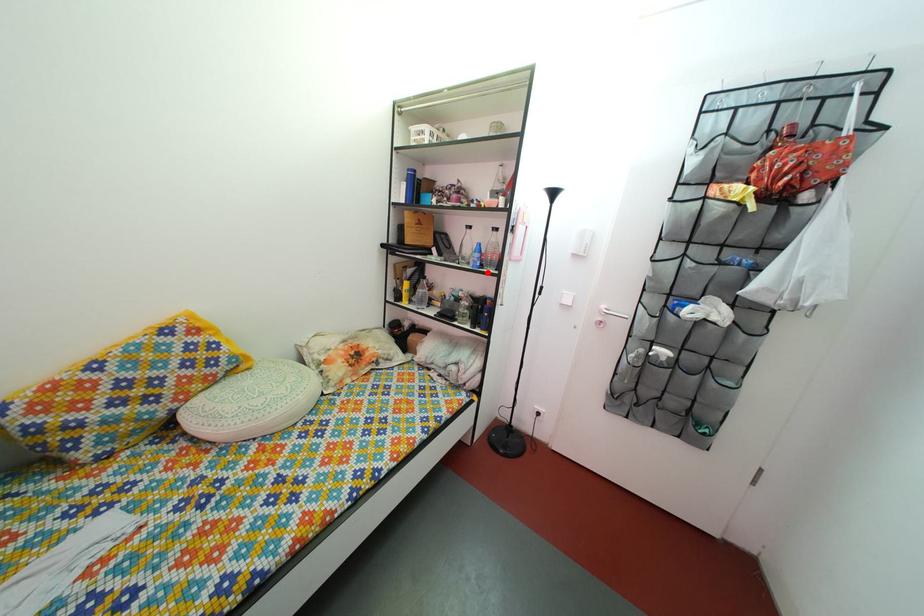
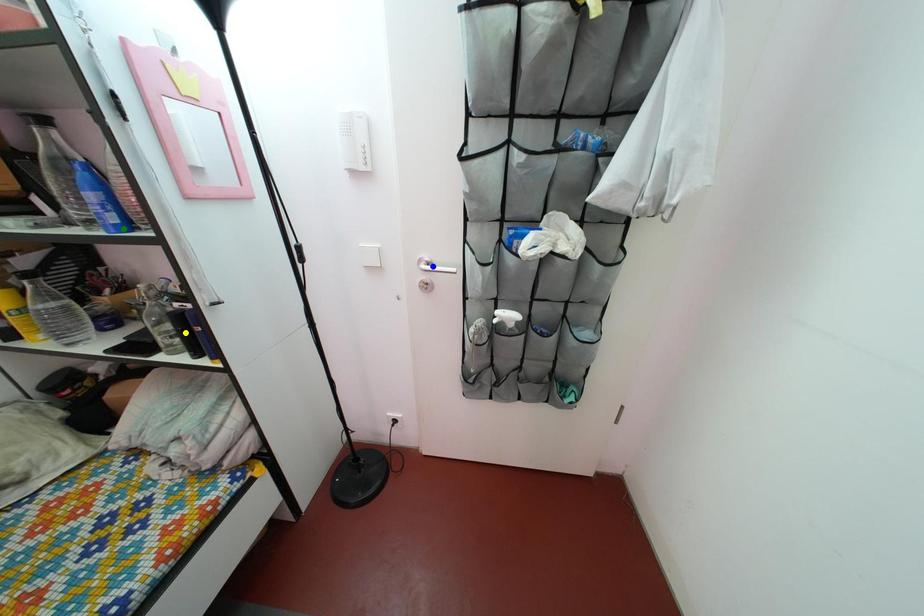
Question: I am providing you with two images of the same scene from different viewpoints. A red point is marked on the first image. You are given multiple points on the second image. Which point in image 2 is actually the same real-world point as the red point in image 1?

Choices:
 (A) yellow point
 (B) green point
 (C) blue point

Answer: (B)